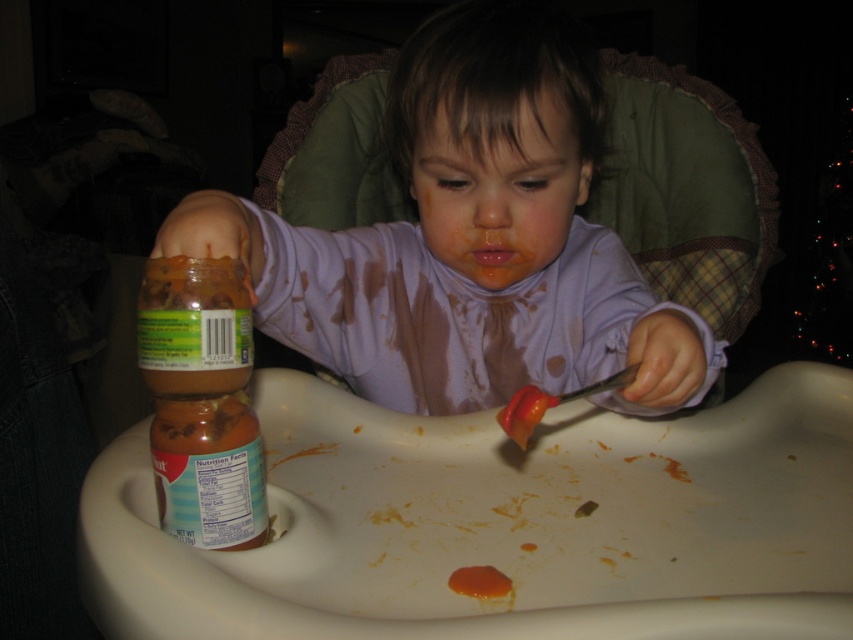
Does point (341, 296) come closer to viewer compared to point (477, 566)?

No, (341, 296) is behind (477, 566).

Does point (558, 369) come behind point (466, 582)?

Yes, it is behind point (466, 582).

Who is more forward, (x=415, y=182) or (x=465, y=593)?

Point (x=465, y=593) is in front.

Find the location of `matte plastic baby at center`. matte plastic baby at center is located at coordinates (469, 240).

The image size is (853, 640). What do you see at coordinates (524, 412) in the screenshot? I see `smooth orange carrot at center` at bounding box center [524, 412].

Is smooth orange carrot at center bigger than smooth orange puree at center?

Yes, smooth orange carrot at center is bigger than smooth orange puree at center.

Locate an element on the screen. This screenshot has height=640, width=853. smooth orange carrot at center is located at coordinates (524, 412).

In the scene shown: Is matte plastic baby at center bigger than smooth orange carrot at center?

Correct, matte plastic baby at center is larger in size than smooth orange carrot at center.

Which of these two, matte plastic baby at center or smooth orange carrot at center, stands taller?

Standing taller between the two is matte plastic baby at center.

Who is more forward, (476, 152) or (521, 390)?

Point (521, 390)

The image size is (853, 640). Identify the location of matte plastic baby at center. (469, 240).